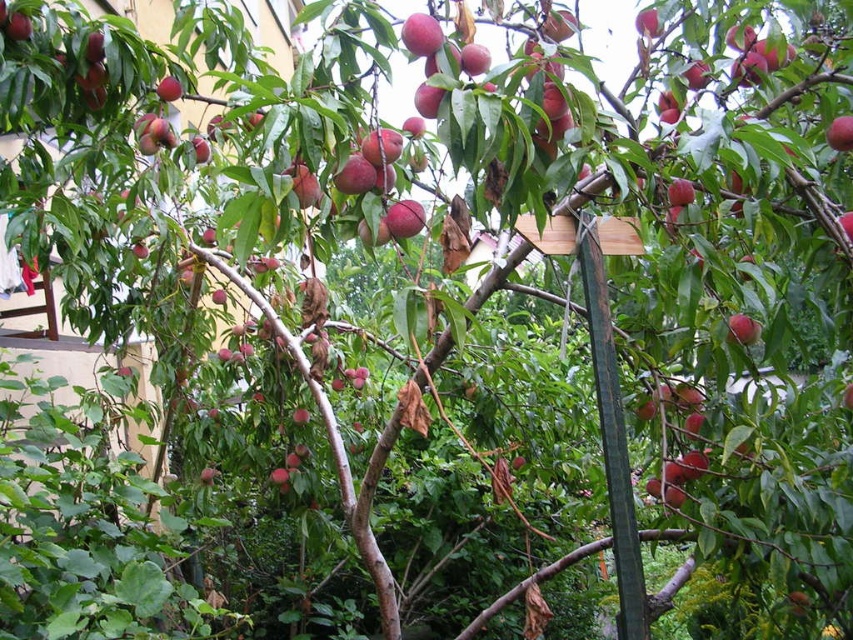
Between point (625, 444) and point (747, 328), which one is positioned in front?

Point (747, 328) is in front.

Describe the element at coordinates (612, 436) in the screenshot. I see `green wood pole at center` at that location.

Find the location of a particular element. Image resolution: width=853 pixels, height=640 pixels. green wood pole at center is located at coordinates (612, 436).

Does red matte peach at upper right come behind matte red peach at upper left?

No.

Does red matte peach at upper right appear over matte red peach at upper left?

Incorrect, red matte peach at upper right is not positioned above matte red peach at upper left.

Does point (849, 129) come in front of point (157, 83)?

Yes, point (849, 129) is in front of point (157, 83).

Locate an element on the screen. The image size is (853, 640). red matte peach at upper right is located at coordinates (840, 132).

Based on the photo, how distant is smooth red peach at center from red matte peach at upper right?

16.38 inches

In the scene shown: Is the position of smooth red peach at center more distant than that of red matte peach at upper right?

Yes, smooth red peach at center is further from the viewer.

Between point (746, 324) and point (834, 122), which one is positioned behind?

Point (746, 324)

This screenshot has height=640, width=853. I want to click on smooth red peach at center, so click(x=741, y=330).